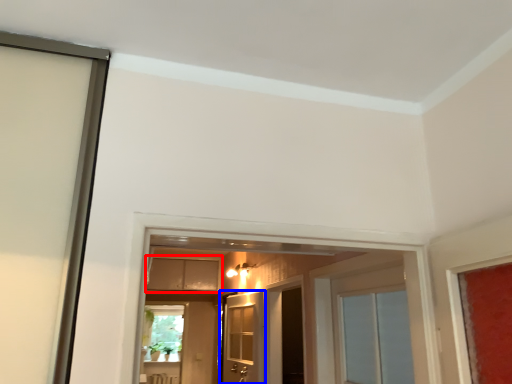
Question: Which object appears farthest to the camera in this image, cabinetry (highlighted by a red box) or door (highlighted by a blue box)?

Choices:
 (A) cabinetry
 (B) door

Answer: (A)